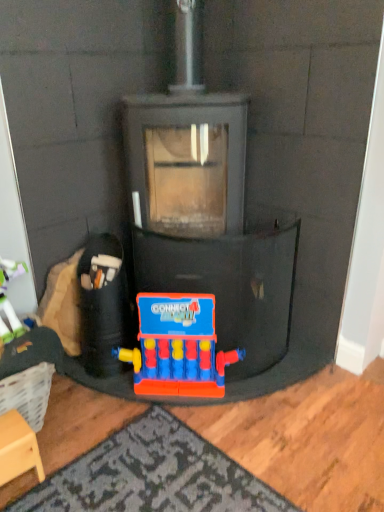
Question: Would you say wooden stool at lower left is inside or outside plastic connect four game at center, the 1th toy when ordered from right to left?

Choices:
 (A) inside
 (B) outside

Answer: (B)

Question: From the image's perspective, is wooden stool at lower left above or below plastic connect four game at center, the 2th toy when ordered from left to right?

Choices:
 (A) above
 (B) below

Answer: (B)

Question: Considering the real-world distances, which object is farthest from the rubberized plastic toy at lower center, the second toy from the right?

Choices:
 (A) wooden stool at lower left
 (B) plastic connect four game at center, the 1th toy when ordered from right to left

Answer: (A)

Question: Considering the real-world distances, which object is farthest from the wooden stool at lower left?

Choices:
 (A) plastic connect four game at center, the 2th toy when ordered from left to right
 (B) rubberized plastic toy at lower center, the second toy from the right

Answer: (A)